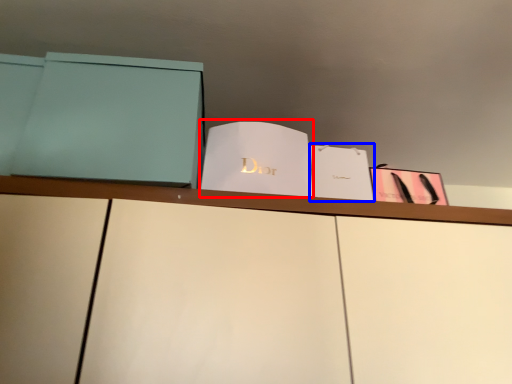
Question: Which of the following is the farthest to the observer, paperback book (highlighted by a red box) or paperback book (highlighted by a blue box)?

Choices:
 (A) paperback book
 (B) paperback book

Answer: (B)